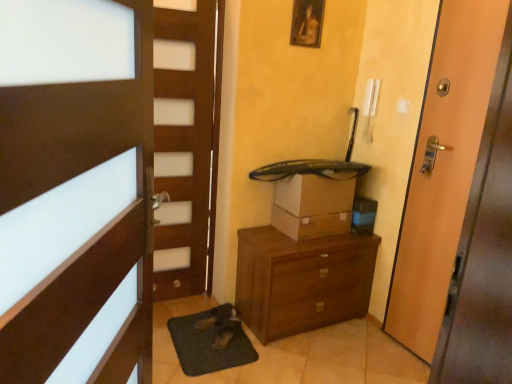
Question: Is green rubber bath mat at lower center far away from wooden door at right, the 1th door when ordered from right to left?

Choices:
 (A) yes
 (B) no

Answer: (A)

Question: Is green rubber bath mat at lower center not inside wooden door at right, which is counted as the second door, starting from the front?

Choices:
 (A) yes
 (B) no

Answer: (A)

Question: From a real-world perspective, does green rubber bath mat at lower center stand above wooden door at right, which is counted as the second door, starting from the front?

Choices:
 (A) yes
 (B) no

Answer: (B)

Question: From the image's perspective, would you say green rubber bath mat at lower center is shown under wooden door at right, which is counted as the 2th door, starting from the left?

Choices:
 (A) yes
 (B) no

Answer: (A)

Question: Considering the relative positions of green rubber bath mat at lower center and wooden door at right, which is counted as the 2th door, starting from the left, in the image provided, is green rubber bath mat at lower center to the left of wooden door at right, which is counted as the 2th door, starting from the left, from the viewer's perspective?

Choices:
 (A) no
 (B) yes

Answer: (B)

Question: From a real-world perspective, is brown wooden door at left, which is the first door in front-to-back order, physically located above or below wooden door at right, which is counted as the first door, starting from the back?

Choices:
 (A) below
 (B) above

Answer: (B)

Question: Is brown wooden door at left, which is the first door in front-to-back order, taller or shorter than wooden door at right, which is counted as the 2th door, starting from the left?

Choices:
 (A) short
 (B) tall

Answer: (A)

Question: In terms of width, does brown wooden door at left, acting as the second door starting from the back, look wider or thinner when compared to wooden door at right, which is counted as the first door, starting from the back?

Choices:
 (A) thin
 (B) wide

Answer: (B)

Question: Considering the positions of point (100, 367) and point (449, 102), is point (100, 367) closer or farther from the camera than point (449, 102)?

Choices:
 (A) closer
 (B) farther

Answer: (A)

Question: Is point (241, 269) closer or farther from the camera than point (86, 261)?

Choices:
 (A) farther
 (B) closer

Answer: (A)

Question: In terms of height, does brown wooden chest of drawers at center look taller or shorter compared to brown wooden door at left, the 1th door in the left-to-right sequence?

Choices:
 (A) short
 (B) tall

Answer: (A)

Question: Considering the positions of brown wooden chest of drawers at center and brown wooden door at left, acting as the second door starting from the back, in the image, is brown wooden chest of drawers at center wider or thinner than brown wooden door at left, acting as the second door starting from the back,?

Choices:
 (A) thin
 (B) wide

Answer: (B)

Question: Is brown wooden chest of drawers at center bigger or smaller than brown wooden door at left, acting as the second door starting from the back?

Choices:
 (A) small
 (B) big

Answer: (B)

Question: From a real-world perspective, is brown cardboard box at center above or below wooden picture frame at upper center?

Choices:
 (A) below
 (B) above

Answer: (A)

Question: Looking at their shapes, would you say brown cardboard box at center is wider or thinner than wooden picture frame at upper center?

Choices:
 (A) wide
 (B) thin

Answer: (A)